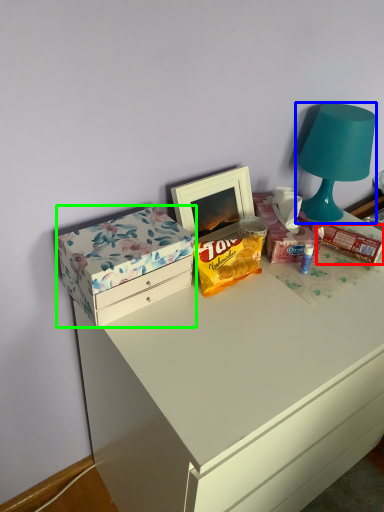
Question: Estimate the real-world distances between objects in this image. Which object is farther from snack (highlighted by a red box), lamp (highlighted by a blue box) or box (highlighted by a green box)?

Choices:
 (A) lamp
 (B) box

Answer: (B)